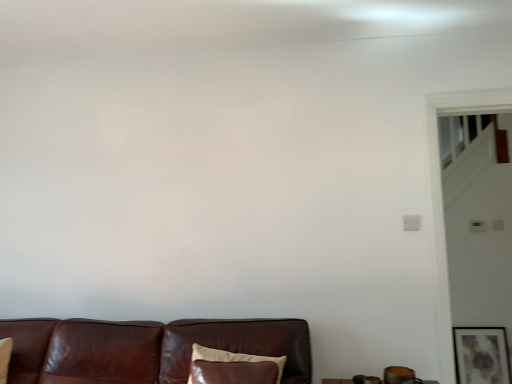
Question: Looking at their shapes, would you say brown leather pillow at lower center is wider or thinner than matte gray painting at lower right?

Choices:
 (A) wide
 (B) thin

Answer: (A)

Question: From their relative heights in the image, would you say brown leather pillow at lower center is taller or shorter than matte gray painting at lower right?

Choices:
 (A) short
 (B) tall

Answer: (A)

Question: Which of these objects is positioned farthest from the brown leather pillow at lower center?

Choices:
 (A) brown leather couch at lower center
 (B) matte gray painting at lower right

Answer: (B)

Question: Which is nearer to the brown leather pillow at lower center?

Choices:
 (A) matte gray painting at lower right
 (B) brown leather couch at lower center

Answer: (B)